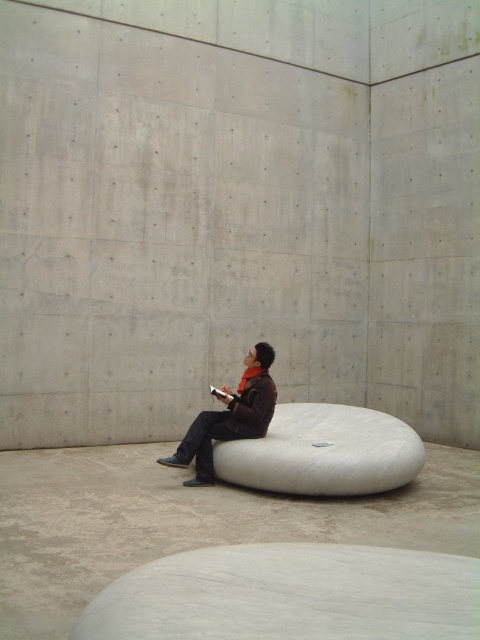
Question: Which object is farther from the camera taking this photo?

Choices:
 (A) white matte bean bag chair at center
 (B) white smooth concrete at center
 (C) dark brown leather jacket at center

Answer: (C)

Question: Which of these objects is positioned closest to the dark brown leather jacket at center?

Choices:
 (A) white smooth concrete at center
 (B) white matte bean bag chair at center

Answer: (B)

Question: Can you confirm if white matte bean bag chair at center is positioned above dark brown leather jacket at center?

Choices:
 (A) no
 (B) yes

Answer: (A)

Question: Can you confirm if white smooth concrete at center is positioned to the right of dark brown leather jacket at center?

Choices:
 (A) yes
 (B) no

Answer: (A)

Question: Is white smooth concrete at center positioned before dark brown leather jacket at center?

Choices:
 (A) no
 (B) yes

Answer: (B)

Question: Which object is the closest to the dark brown leather jacket at center?

Choices:
 (A) white smooth concrete at center
 (B) white matte bean bag chair at center

Answer: (B)